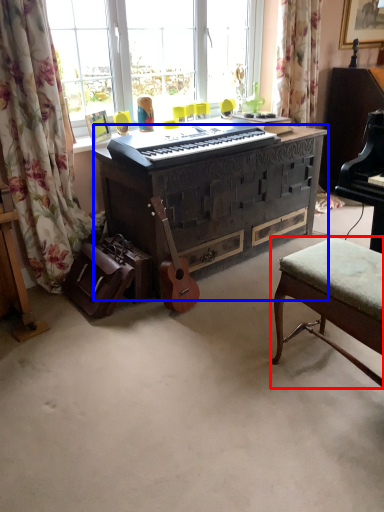
Question: Which object is closer to the camera taking this photo, stool (highlighted by a red box) or desk (highlighted by a blue box)?

Choices:
 (A) stool
 (B) desk

Answer: (A)